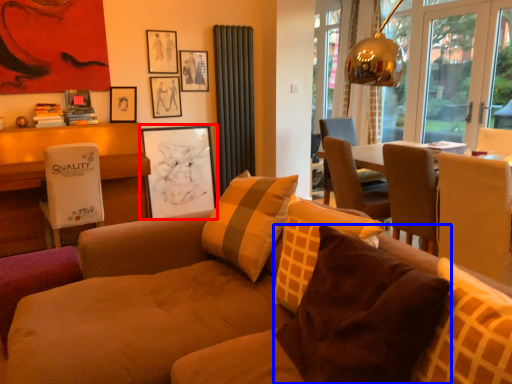
Question: Which of the following is the closest to the observer, picture frame (highlighted by a red box) or pillow (highlighted by a blue box)?

Choices:
 (A) picture frame
 (B) pillow

Answer: (B)